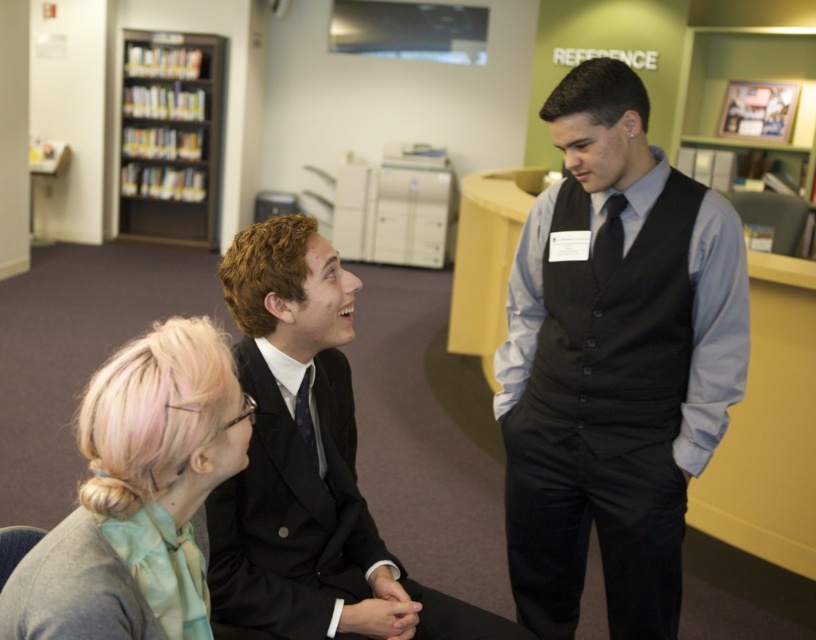
Between point (165, 419) and point (149, 97), which one is positioned in front?

Point (165, 419)

Who is more forward, (78, 627) or (211, 102)?

Point (78, 627)

You are a GUI agent. You are given a task and a screenshot of the screen. Output one action in this format:
    pyautogui.click(x=<x>, y=<y>)
    Task: Click on the blonde hair at left
    This screenshot has width=816, height=640.
    Given the screenshot: What is the action you would take?
    pyautogui.click(x=138, y=496)

Which of these two, matte black suit at center or matte black tie at center, stands taller?

matte black suit at center is taller.

Between point (409, 634) and point (304, 433), which one is positioned in front?

Point (409, 634) is more forward.

Between point (313, 378) and point (308, 406), which one is positioned behind?

Point (313, 378)

You are a GUI agent. You are given a task and a screenshot of the screen. Output one action in this format:
    pyautogui.click(x=<x>, y=<y>)
    Task: Click on the matte black suit at center
    
    Given the screenshot: What is the action you would take?
    pyautogui.click(x=308, y=467)

Can you confirm if matte black vest at center is positioned to the left of black wood bookshelf at upper left?

No, matte black vest at center is not to the left of black wood bookshelf at upper left.

Is matte black vest at center shorter than black wood bookshelf at upper left?

Correct, matte black vest at center is not as tall as black wood bookshelf at upper left.

Who is more distant from viewer, (557, 456) or (134, 125)?

The point (134, 125) is behind.

Find the location of a particular element. This screenshot has width=816, height=640. matte black vest at center is located at coordinates (614, 364).